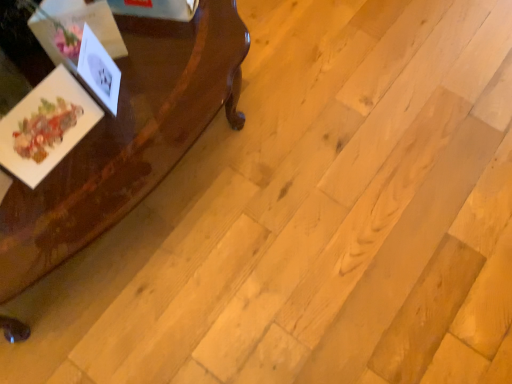
Locate an element on the screen. This screenshot has width=512, height=384. vacant area that is situated to the right of matte paper postcard at left, the 1th postcard in the left-to-right sequence is located at coordinates (106, 154).